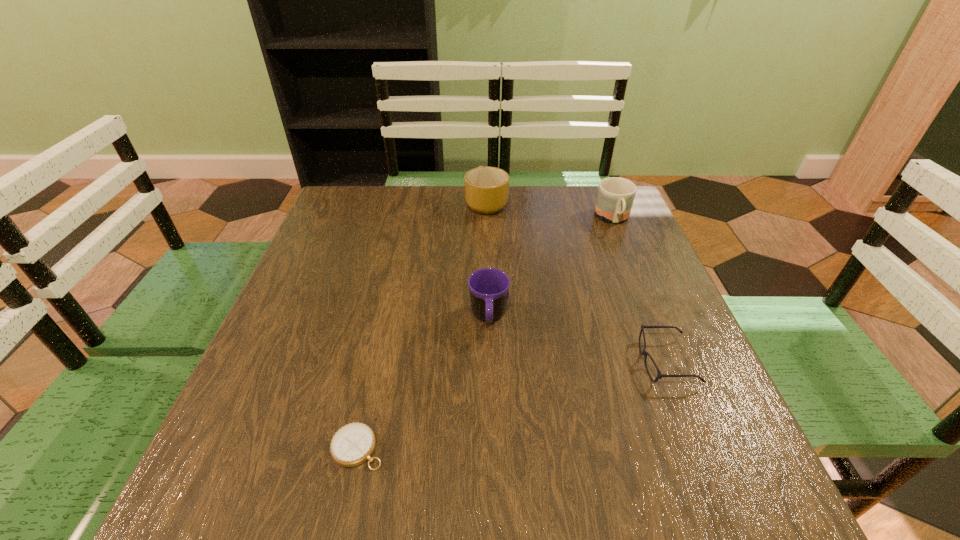
You are a GUI agent. You are given a task and a screenshot of the screen. Output one action in this format:
    pyautogui.click(x=<x>, y=<y>)
    Task: Click on the blank space located on the left of the leftmost object
    This screenshot has width=960, height=540.
    Given the screenshot: What is the action you would take?
    pyautogui.click(x=241, y=448)

In order to click on object present at the near edge in this screenshot , I will do `click(353, 444)`.

Where is `mug that is at the right edge`? mug that is at the right edge is located at coordinates (615, 197).

In order to click on spectacles that is at the right edge in this screenshot , I will do `click(645, 353)`.

The height and width of the screenshot is (540, 960). I want to click on object located at the far right corner, so click(615, 197).

The height and width of the screenshot is (540, 960). I want to click on vacant space at the far edge of the desktop, so 565,188.

In the image, there is a desktop. Where is `free space at the near edge`? free space at the near edge is located at coordinates (588, 488).

Identify the location of vacant region at the left edge. Image resolution: width=960 pixels, height=540 pixels. (298, 382).

In the image, there is a desktop. Identify the location of vacant space at the right edge. The height and width of the screenshot is (540, 960). (648, 261).

Locate an element on the screen. This screenshot has height=540, width=960. free region at the far left corner of the desktop is located at coordinates (352, 215).